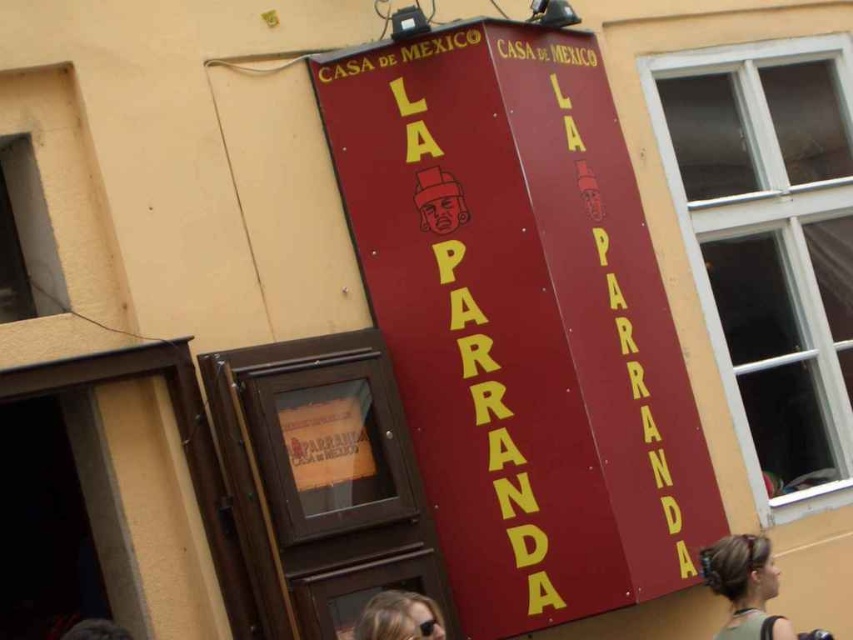
Consider the image. You are standing in front of the building and notice the matte red sign at center and the blonde hair at center. Which object is bigger in size?

The matte red sign at center has a larger size compared to the blonde hair at center.

In the scene shown: You are standing in front of the building and want to locate the matte red sign at center. According to the coordinates provided in the description, where should you look relative to the beige wall?

The matte red sign at center is located at point coordinates 0.500 in the x axis and 0.612 in the y axis relative to the beige wall.

You are standing in front of the building shown in the image. There is a point at coordinates (746,586) marked as blonde hair at center. Can you tell me what is located at those coordinates?

The point at coordinates (746,586) indicates blonde hair at center.